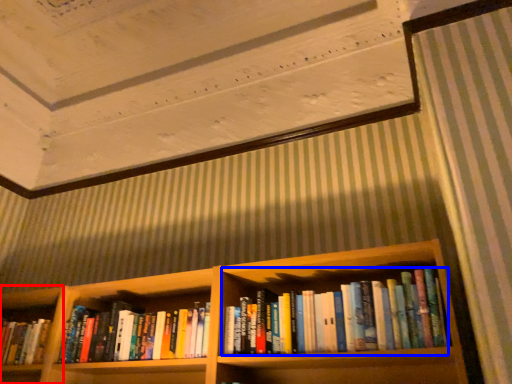
Question: Among these objects, which one is farthest to the camera, shelf (highlighted by a red box) or book (highlighted by a blue box)?

Choices:
 (A) shelf
 (B) book

Answer: (A)